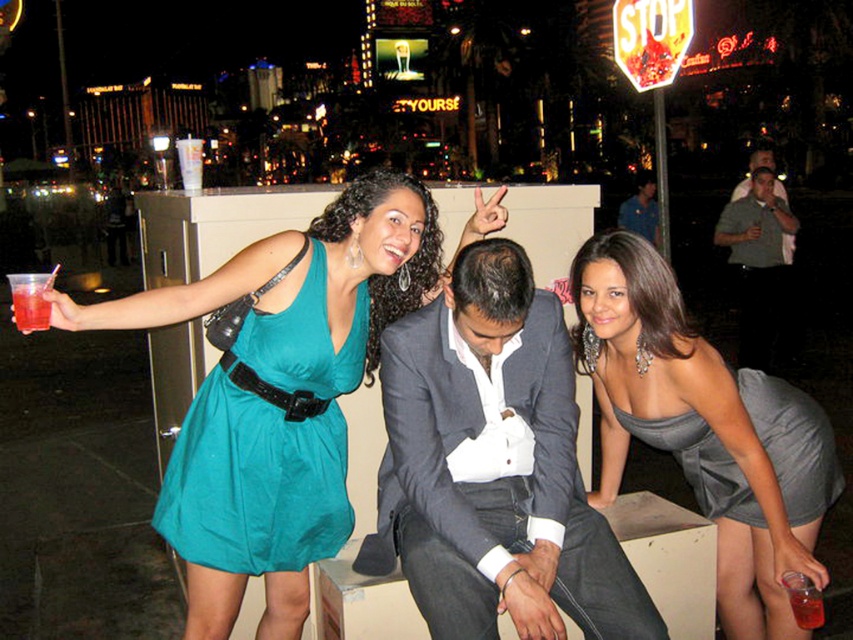
Question: Estimate the real-world distances between objects in this image. Which object is closer to the translucent plastic cup at lower right?

Choices:
 (A) teal satin dress at left
 (B) satin gray dress at lower right
 (C) gray fabric suit at center
 (D) translucent plastic cup at upper left

Answer: (B)

Question: Which object is positioned closest to the gray fabric suit at center?

Choices:
 (A) gray satin dress at lower right
 (B) translucent plastic cup at upper left
 (C) teal satin dress at upper left
 (D) satin gray dress at lower right

Answer: (C)

Question: Which object is the farthest from the satin gray dress at lower right?

Choices:
 (A) blue denim shirt at upper right
 (B) gray fabric suit at center
 (C) teal satin dress at upper left
 (D) gray satin dress at lower right

Answer: (A)

Question: Is gray satin dress at lower right closer to the viewer compared to blue denim shirt at upper right?

Choices:
 (A) yes
 (B) no

Answer: (A)

Question: Is gray fabric suit at center further to camera compared to translucent plastic cup at upper left?

Choices:
 (A) yes
 (B) no

Answer: (A)

Question: Can you confirm if teal satin dress at upper left is positioned below blue denim shirt at upper right?

Choices:
 (A) yes
 (B) no

Answer: (A)